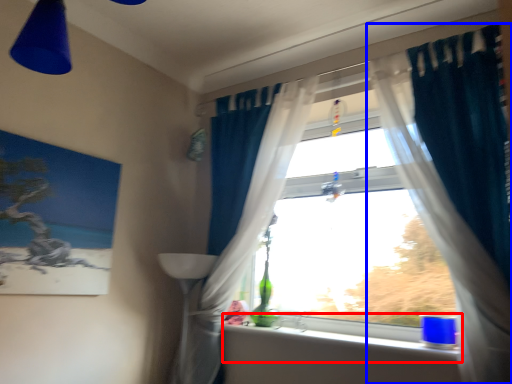
Question: Among these objects, which one is farthest to the camera, window sill (highlighted by a red box) or curtain (highlighted by a blue box)?

Choices:
 (A) window sill
 (B) curtain

Answer: (A)